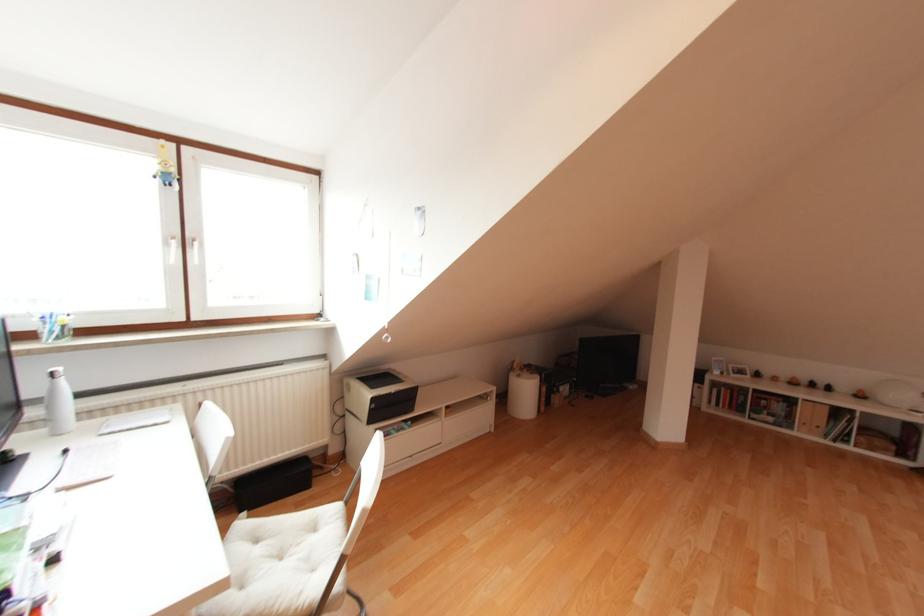
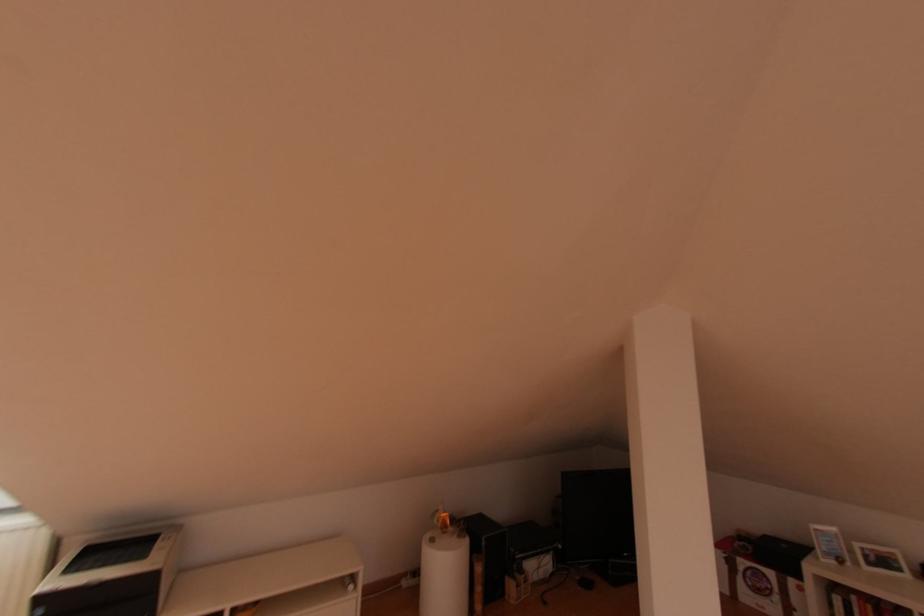
The point at (x=722, y=373) is marked in the first image. Where is the corresponding point in the second image?

(840, 562)